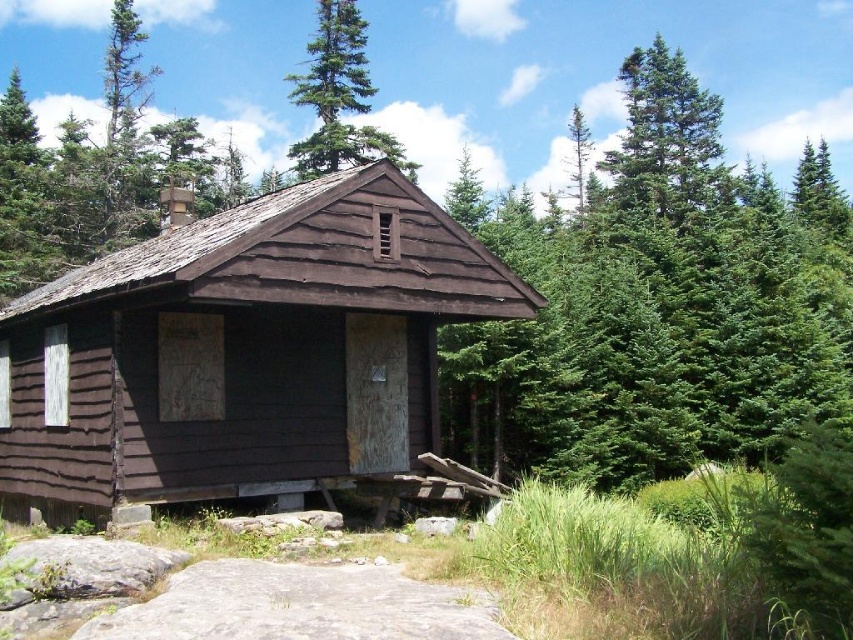
Question: Is green evergreen tree at center behind green coniferous tree at upper center?

Choices:
 (A) yes
 (B) no

Answer: (B)

Question: Which point is farther to the camera?

Choices:
 (A) (463, 410)
 (B) (374, 129)
 (C) (167, 275)

Answer: (B)

Question: Which point is closer to the camera taking this photo?

Choices:
 (A) (846, 346)
 (B) (160, 248)
 (C) (322, 38)

Answer: (B)

Question: In this image, where is brown wooden cabin at center located relative to green evergreen tree at center?

Choices:
 (A) above
 (B) below

Answer: (B)

Question: Does brown wooden cabin at center have a smaller size compared to green evergreen tree at center?

Choices:
 (A) no
 (B) yes

Answer: (B)

Question: Which of the following is the closest to the observer?

Choices:
 (A) green coniferous tree at upper center
 (B) green evergreen tree at center
 (C) brown wooden cabin at center

Answer: (C)